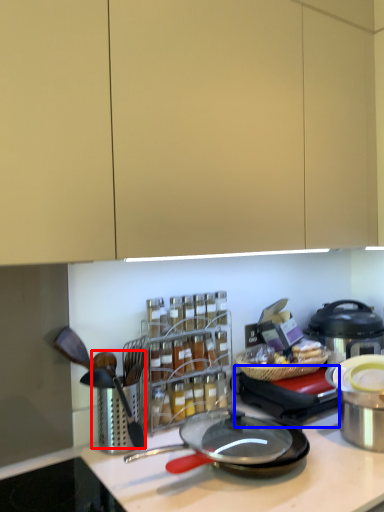
Question: Among these objects, which one is farthest to the camera, utensil (highlighted by a red box) or appliance (highlighted by a blue box)?

Choices:
 (A) utensil
 (B) appliance

Answer: (B)